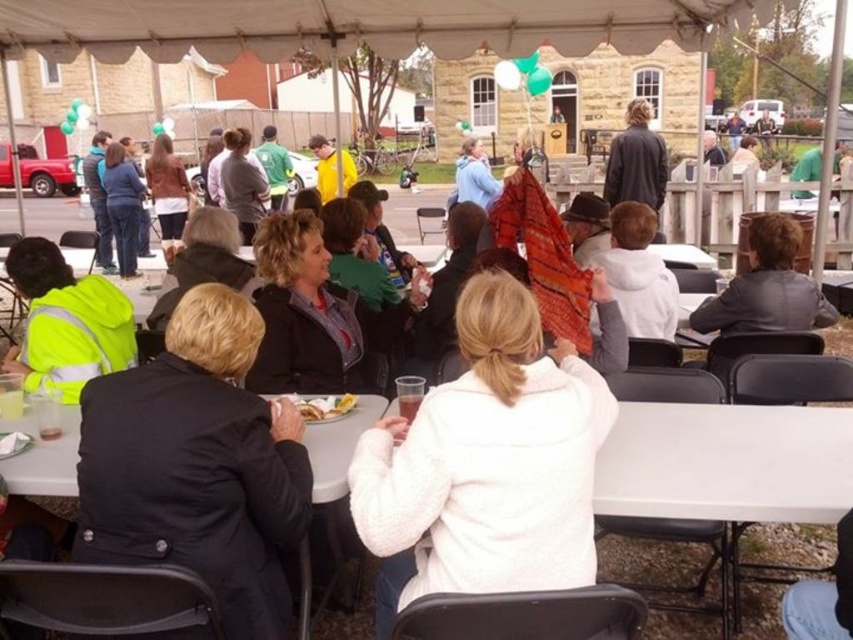
Question: Where is white fleece jacket at center located in relation to golden crispy chicken at center in the image?

Choices:
 (A) left
 (B) right

Answer: (B)

Question: Estimate the real-world distances between objects in this image. Which object is closer to the black matte jacket at lower left?

Choices:
 (A) dark gray coat at upper right
 (B) white plastic table at lower center
 (C) white fleece jacket at center
 (D) white plastic table at center

Answer: (B)

Question: Does dark gray coat at upper right have a smaller size compared to yellow fabric jacket at center?

Choices:
 (A) no
 (B) yes

Answer: (A)

Question: Is white plastic table at lower center further to the viewer compared to golden crispy chicken at center?

Choices:
 (A) no
 (B) yes

Answer: (A)

Question: Which is nearer to the leather jacket at center?

Choices:
 (A) white plastic table at lower center
 (B) black matte jacket at lower left

Answer: (B)

Question: Which of the following is the farthest from the observer?

Choices:
 (A) (782, 410)
 (B) (70, 328)

Answer: (B)